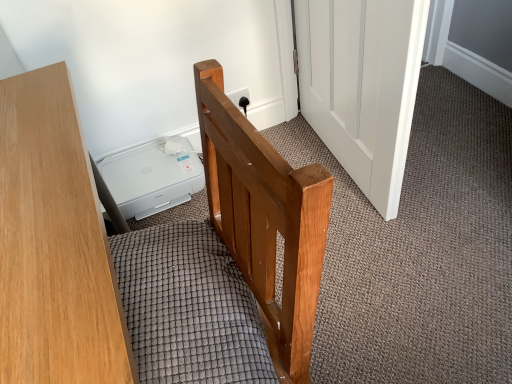
Question: Is there a large distance between white wooden door at center and wooden desk at left?

Choices:
 (A) yes
 (B) no

Answer: (B)

Question: Is white wooden door at center positioned before wooden desk at left?

Choices:
 (A) no
 (B) yes

Answer: (A)

Question: Is white wooden door at center facing away from wooden desk at left?

Choices:
 (A) yes
 (B) no

Answer: (B)

Question: From the image's perspective, would you say white wooden door at center is shown under wooden desk at left?

Choices:
 (A) yes
 (B) no

Answer: (B)

Question: From the image's perspective, would you say white wooden door at center is positioned over wooden desk at left?

Choices:
 (A) no
 (B) yes

Answer: (B)

Question: Can you confirm if white wooden door at center is smaller than wooden desk at left?

Choices:
 (A) no
 (B) yes

Answer: (B)

Question: Is wooden desk at left at the back of textured gray mattress at center?

Choices:
 (A) yes
 (B) no

Answer: (B)

Question: From a real-world perspective, is textured gray mattress at center physically above wooden desk at left?

Choices:
 (A) no
 (B) yes

Answer: (B)

Question: From the image's perspective, is textured gray mattress at center beneath wooden desk at left?

Choices:
 (A) yes
 (B) no

Answer: (B)

Question: Is textured gray mattress at center not within wooden desk at left?

Choices:
 (A) yes
 (B) no

Answer: (A)

Question: Is textured gray mattress at center touching wooden desk at left?

Choices:
 (A) no
 (B) yes

Answer: (A)

Question: Is wooden desk at left a part of textured gray mattress at center?

Choices:
 (A) no
 (B) yes

Answer: (A)

Question: Can you confirm if wooden desk at left is thinner than textured gray mattress at center?

Choices:
 (A) no
 (B) yes

Answer: (A)